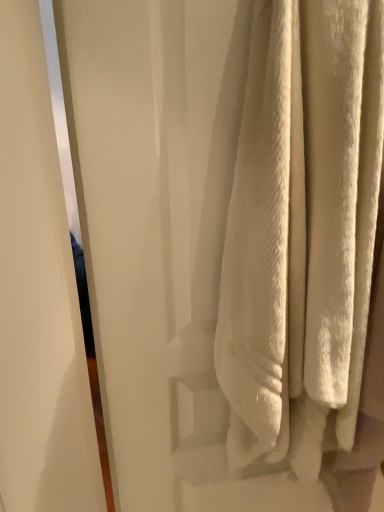
What do you see at coordinates (302, 229) in the screenshot?
I see `white textured towel at right` at bounding box center [302, 229].

Locate an element on the screen. This screenshot has width=384, height=512. white textured towel at right is located at coordinates (302, 229).

Locate an element on the screen. white textured towel at right is located at coordinates (302, 229).